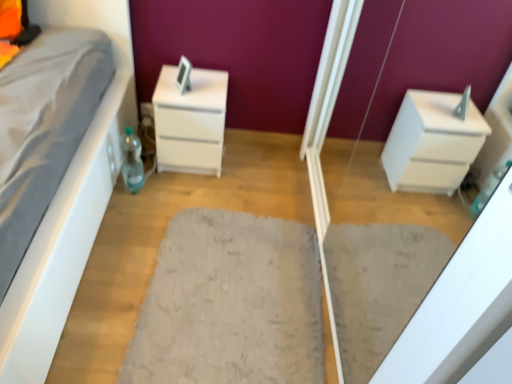
This screenshot has width=512, height=384. Identify the location of free space between white glossy chest of drawers at center and gray fluffy rug at center. (217, 203).